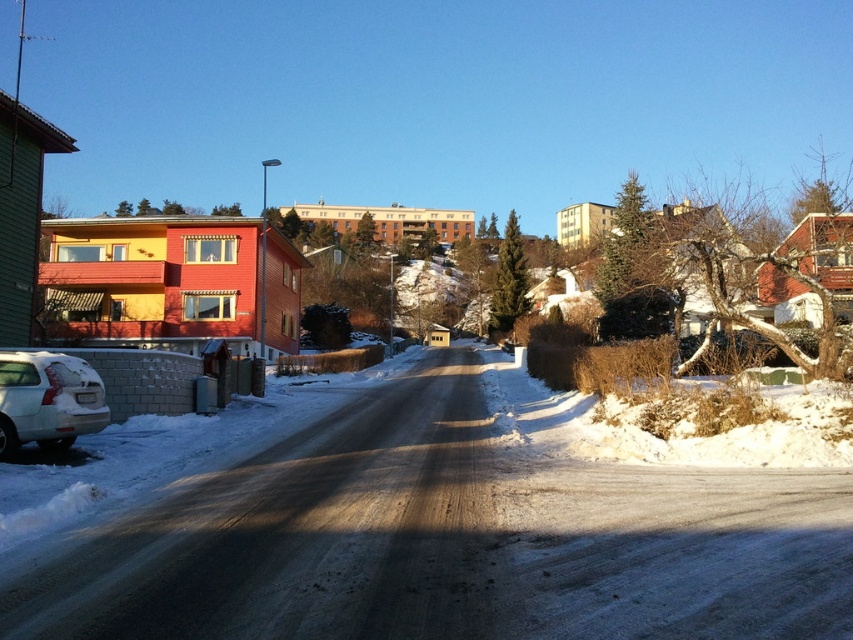
Question: Does white powdery snow at center appear under white matte car at lower left?

Choices:
 (A) no
 (B) yes

Answer: (B)

Question: Can you confirm if white powdery snow at center is positioned to the left of white matte car at lower left?

Choices:
 (A) yes
 (B) no

Answer: (B)

Question: Which of the following is the closest to the observer?

Choices:
 (A) (375, 528)
 (B) (1, 428)

Answer: (A)

Question: Is white powdery snow at center to the left of white matte car at lower left from the viewer's perspective?

Choices:
 (A) no
 (B) yes

Answer: (A)

Question: Which of the following is the farthest from the observer?

Choices:
 (A) (407, 580)
 (B) (4, 417)

Answer: (B)